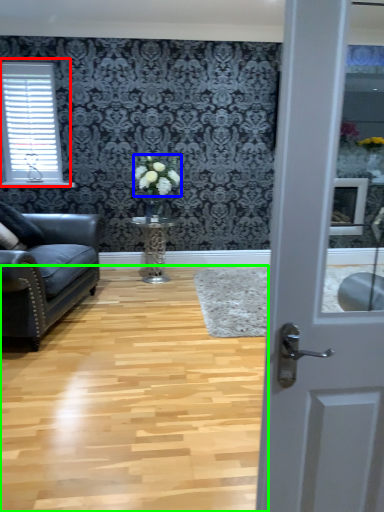
Question: Which object is positioned farthest from window (highlighted by a red box)? Select from flower (highlighted by a blue box) and plain (highlighted by a green box).

Choices:
 (A) flower
 (B) plain

Answer: (B)